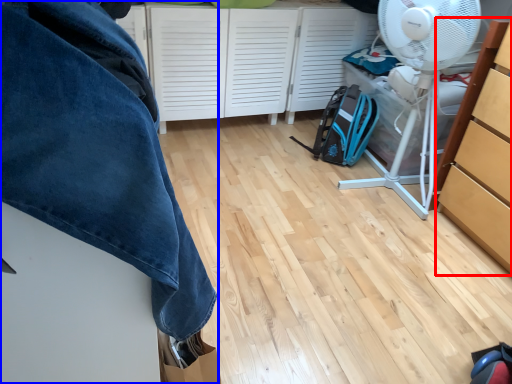
Question: Which of the following is the closest to the observer, cabinetry (highlighted by a red box) or furniture (highlighted by a blue box)?

Choices:
 (A) cabinetry
 (B) furniture

Answer: (B)